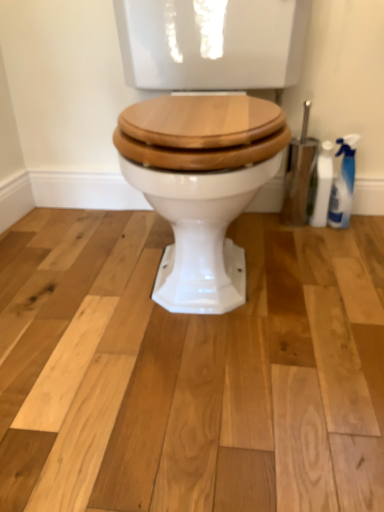
Question: Is there a large distance between white plastic spray bottle at right, arranged as the 1th cleaning product when viewed from the left, and translucent plastic spray bottle at right, arranged as the 1th cleaning product when viewed from the right?

Choices:
 (A) yes
 (B) no

Answer: (B)

Question: Does white plastic spray bottle at right, arranged as the 1th cleaning product when viewed from the left, have a smaller size compared to translucent plastic spray bottle at right, arranged as the 1th cleaning product when viewed from the right?

Choices:
 (A) no
 (B) yes

Answer: (B)

Question: Can you confirm if white plastic spray bottle at right, which ranks as the second cleaning product in right-to-left order, is bigger than translucent plastic spray bottle at right, the 2th cleaning product from the left?

Choices:
 (A) yes
 (B) no

Answer: (B)

Question: From a real-world perspective, is white plastic spray bottle at right, which ranks as the second cleaning product in right-to-left order, positioned over translucent plastic spray bottle at right, the 2th cleaning product from the left, based on gravity?

Choices:
 (A) no
 (B) yes

Answer: (A)

Question: Is white plastic spray bottle at right, arranged as the 1th cleaning product when viewed from the left, at the left side of translucent plastic spray bottle at right, the 2th cleaning product from the left?

Choices:
 (A) no
 (B) yes

Answer: (B)

Question: Is white plastic spray bottle at right, which ranks as the second cleaning product in right-to-left order, in front of translucent plastic spray bottle at right, arranged as the 1th cleaning product when viewed from the right?

Choices:
 (A) no
 (B) yes

Answer: (A)

Question: Considering the relative sizes of translucent plastic spray bottle at right, arranged as the 1th cleaning product when viewed from the right, and white plastic spray bottle at right, which ranks as the second cleaning product in right-to-left order, in the image provided, is translucent plastic spray bottle at right, arranged as the 1th cleaning product when viewed from the right, wider than white plastic spray bottle at right, which ranks as the second cleaning product in right-to-left order,?

Choices:
 (A) yes
 (B) no

Answer: (A)

Question: Can you confirm if translucent plastic spray bottle at right, arranged as the 1th cleaning product when viewed from the right, is smaller than white plastic spray bottle at right, arranged as the 1th cleaning product when viewed from the left?

Choices:
 (A) yes
 (B) no

Answer: (B)

Question: Is translucent plastic spray bottle at right, arranged as the 1th cleaning product when viewed from the right, looking in the opposite direction of white plastic spray bottle at right, which ranks as the second cleaning product in right-to-left order?

Choices:
 (A) yes
 (B) no

Answer: (B)

Question: Is the position of translucent plastic spray bottle at right, arranged as the 1th cleaning product when viewed from the right, less distant than that of white plastic spray bottle at right, arranged as the 1th cleaning product when viewed from the left?

Choices:
 (A) yes
 (B) no

Answer: (A)

Question: Is translucent plastic spray bottle at right, the 2th cleaning product from the left, at the left side of white plastic spray bottle at right, arranged as the 1th cleaning product when viewed from the left?

Choices:
 (A) yes
 (B) no

Answer: (B)

Question: Can you confirm if translucent plastic spray bottle at right, arranged as the 1th cleaning product when viewed from the right, is bigger than white plastic spray bottle at right, which ranks as the second cleaning product in right-to-left order?

Choices:
 (A) no
 (B) yes

Answer: (B)

Question: Based on their positions, is translucent plastic spray bottle at right, the 2th cleaning product from the left, located to the left or right of white plastic spray bottle at right, arranged as the 1th cleaning product when viewed from the left?

Choices:
 (A) right
 (B) left

Answer: (A)